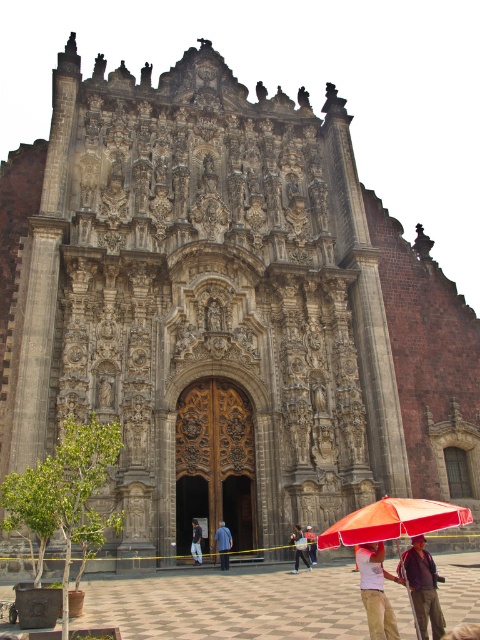
Question: Which point is farther from the camera taking this photo?

Choices:
 (A) (304, 561)
 (B) (375, 621)

Answer: (A)

Question: Can you confirm if orange fabric umbrella at lower center is positioned to the left of dark blue jeans at center?

Choices:
 (A) no
 (B) yes

Answer: (A)

Question: Does brown fabric hat at center appear under blue fabric shirt at center?

Choices:
 (A) no
 (B) yes

Answer: (A)

Question: Which of these objects is positioned farthest from the brown fabric hat at center?

Choices:
 (A) light blue shirt at center
 (B) blue fabric shirt at center
 (C) orange fabric umbrella at lower center

Answer: (B)

Question: Which point is closer to the camera taking this photo?

Choices:
 (A) (226, 538)
 (B) (295, 563)
 (C) (368, 589)
 (D) (311, 540)

Answer: (C)

Question: Can you confirm if blue fabric shirt at center is positioned below dark blue jeans at center?

Choices:
 (A) yes
 (B) no

Answer: (B)